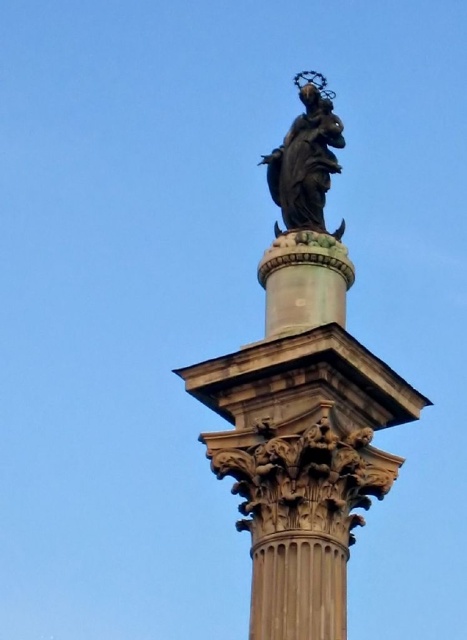
Question: Does bronze statue at upper center appear over polished bronze statue at center?

Choices:
 (A) no
 (B) yes

Answer: (A)

Question: Among these points, which one is nearest to the camera?

Choices:
 (A) (317, 211)
 (B) (280, 166)

Answer: (A)

Question: Among these points, which one is nearest to the camera?

Choices:
 (A) (283, 196)
 (B) (317, 76)

Answer: (A)

Question: Is the position of bronze statue at upper center less distant than that of polished bronze statue at center?

Choices:
 (A) yes
 (B) no

Answer: (A)

Question: Is bronze statue at upper center bigger than polished bronze statue at center?

Choices:
 (A) yes
 (B) no

Answer: (A)